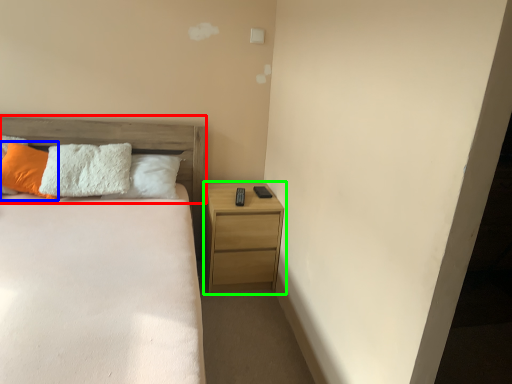
Question: Which object is positioned farthest from headboard (highlighted by a red box)? Select from pillow (highlighted by a blue box) and nightstand (highlighted by a green box).

Choices:
 (A) pillow
 (B) nightstand

Answer: (B)